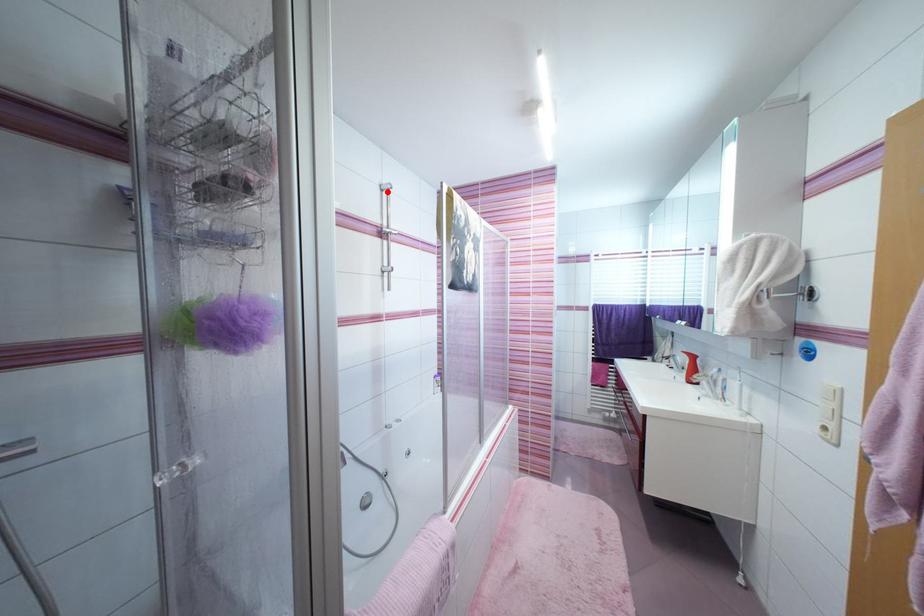
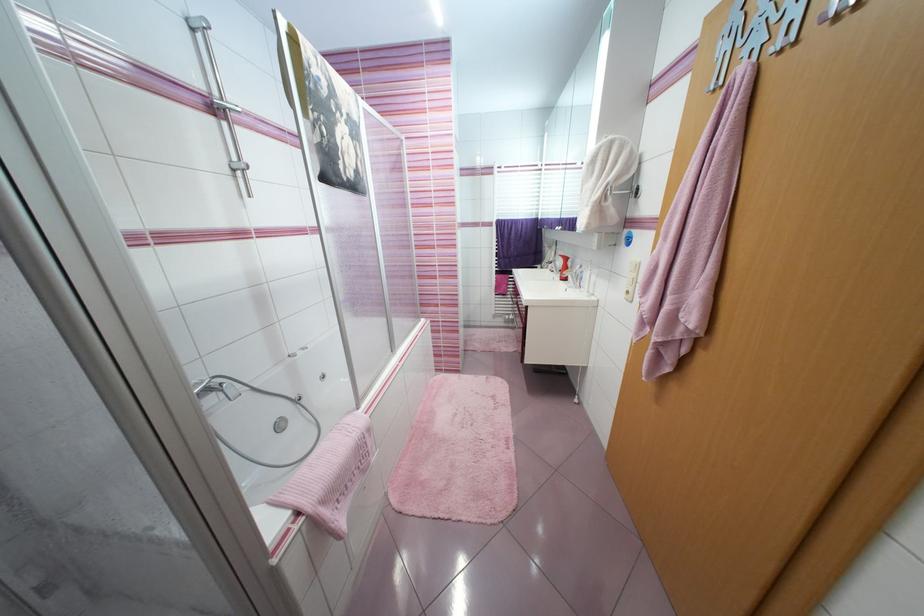
In the second image, find the point that corresponds to the highlighted location in the first image.

(198, 31)